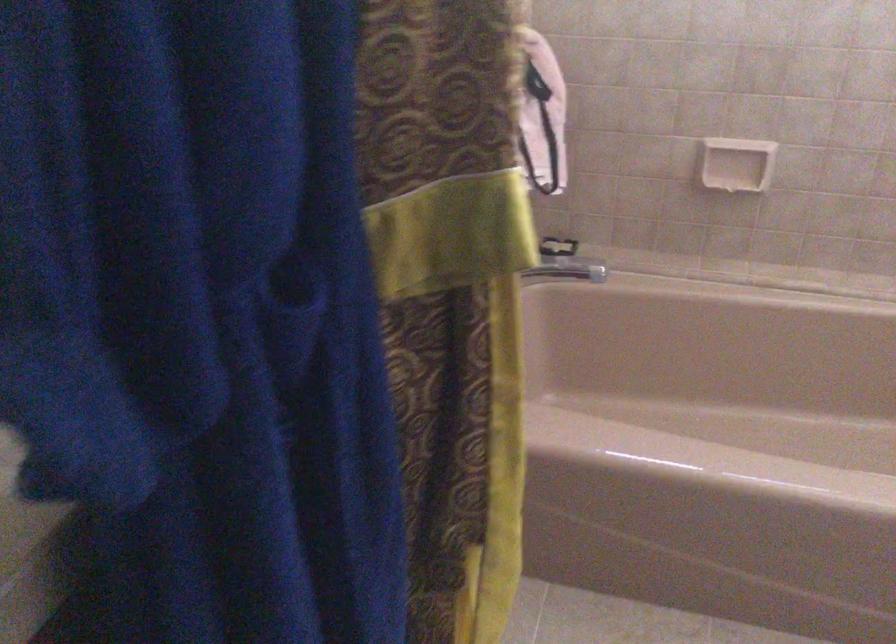
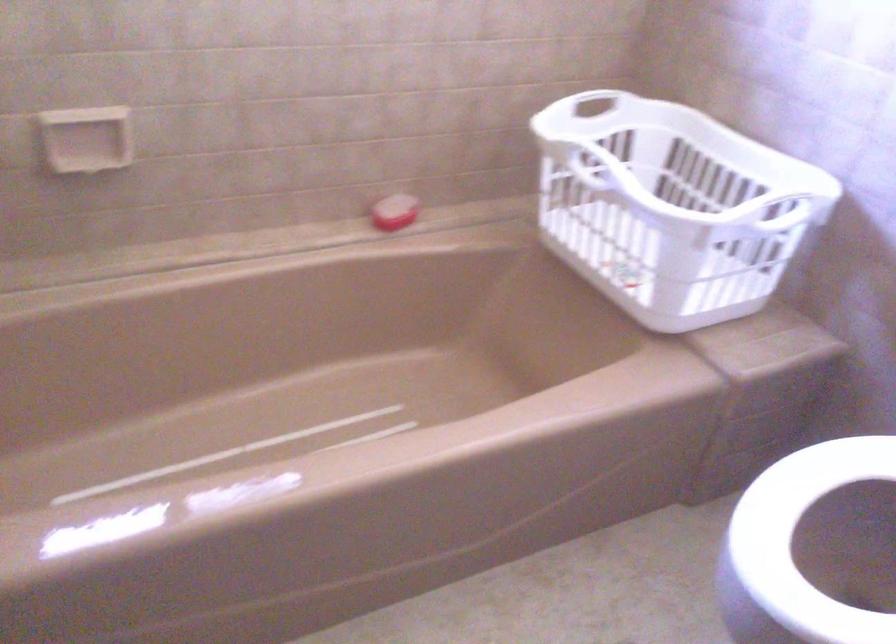
Question: The camera is either moving clockwise (left) or counter-clockwise (right) around the object. The first image is from the beginning of the video and the second image is from the end. Is the camera moving left or right when shooting the video?

Choices:
 (A) Left
 (B) Right

Answer: (A)